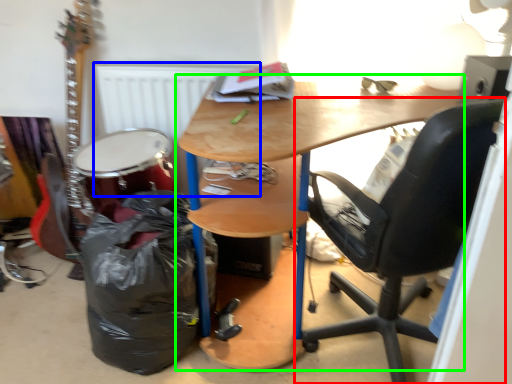
Question: Based on their relative distances, which object is nearer to chair (highlighted by a red box)? Choose from radiator (highlighted by a blue box) and desk (highlighted by a green box).

Choices:
 (A) radiator
 (B) desk

Answer: (B)